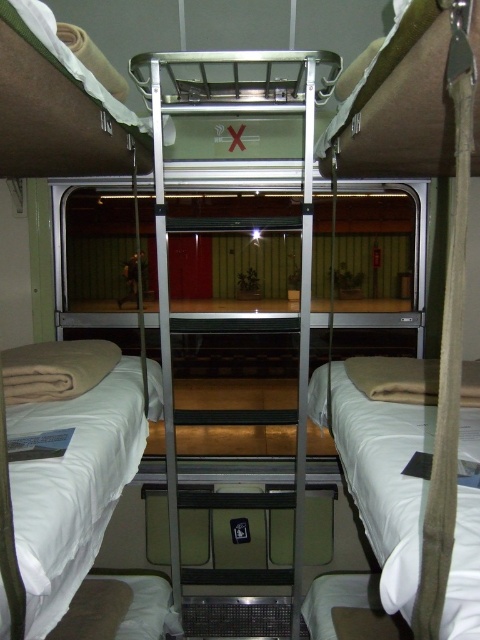
Question: Which of the following is the closest to the observer?

Choices:
 (A) metallic silver bunk bed at center
 (B) white soft bedding at lower right

Answer: (B)

Question: Which of the following is the farthest from the observer?

Choices:
 (A) white soft bedding at lower left
 (B) white soft bedding at lower right

Answer: (A)

Question: Estimate the real-world distances between objects in this image. Which object is farther from the metallic silver bunk bed at center?

Choices:
 (A) white soft bedding at lower left
 (B) white soft bedding at lower right
 (C) white soft pillow at lower left

Answer: (B)

Question: Is white soft bedding at lower left thinner than white soft bedding at lower right?

Choices:
 (A) no
 (B) yes

Answer: (B)

Question: Considering the relative positions of metallic silver bunk bed at center and white soft bedding at lower right in the image provided, where is metallic silver bunk bed at center located with respect to white soft bedding at lower right?

Choices:
 (A) below
 (B) above

Answer: (B)

Question: Does metallic silver bunk bed at center appear under white soft bedding at lower right?

Choices:
 (A) no
 (B) yes

Answer: (A)